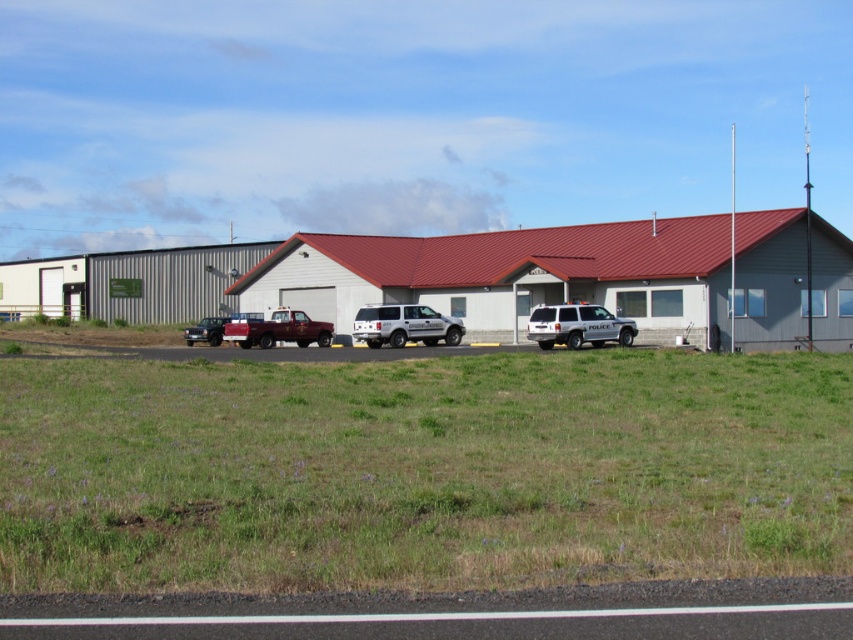
Question: Which point is farther from the camera taking this photo?

Choices:
 (A) (187, 337)
 (B) (579, 336)
 (C) (651, 524)

Answer: (A)

Question: Which point is closer to the camera?

Choices:
 (A) metallic silver suv at left
 (B) green grass at center

Answer: (B)

Question: Among these objects, which one is farthest from the camera?

Choices:
 (A) green grass at center
 (B) silver metallic suv at center
 (C) metallic silver suv at left

Answer: (C)

Question: Can you confirm if silver metallic suv at center is smaller than white matte police suv at center?

Choices:
 (A) no
 (B) yes

Answer: (B)

Question: Can you confirm if green grass at center is positioned to the right of silver metallic suv at center?

Choices:
 (A) yes
 (B) no

Answer: (B)

Question: From the image, what is the correct spatial relationship of white matte police suv at center in relation to brushed metal truck at center?

Choices:
 (A) below
 (B) above

Answer: (A)